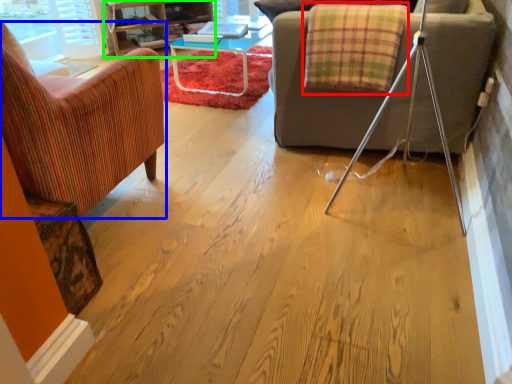
Question: Which is nearer to the blanket (highlighted by a red box)? chair (highlighted by a blue box) or entertainment center (highlighted by a green box).

Choices:
 (A) chair
 (B) entertainment center

Answer: (A)